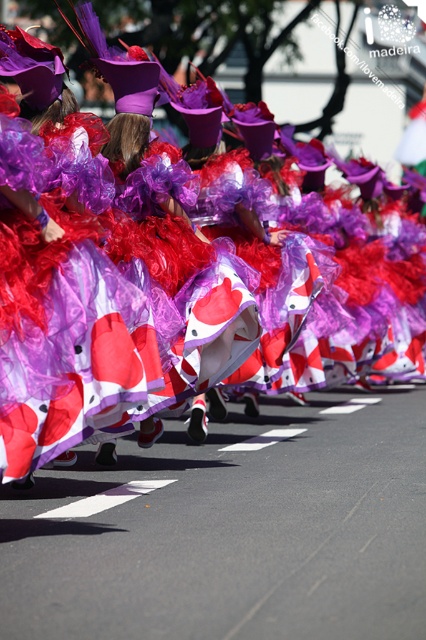
Consider the image. Is matte purple fabric at center thinner than white solid line at center?

No.

The width and height of the screenshot is (426, 640). Identify the location of matte purple fabric at center. (58, 275).